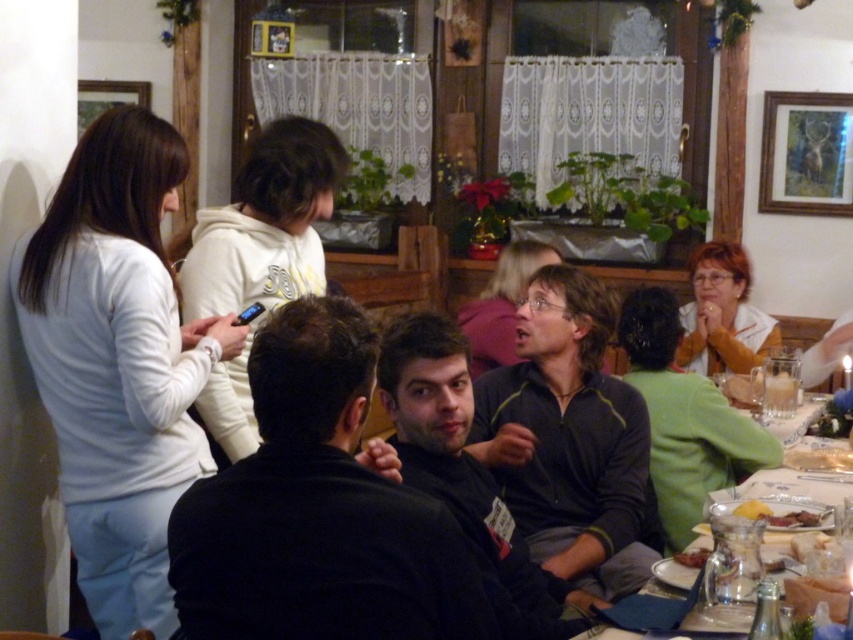
Question: Is matte black shirt at center positioned in front of shiny silver fork at lower right?

Choices:
 (A) no
 (B) yes

Answer: (A)

Question: Which point is farther to the camera?

Choices:
 (A) (289, 240)
 (B) (698, 566)
 (C) (628, 353)
 (D) (519, 380)

Answer: (C)

Question: Among these points, which one is farthest from the camera?

Choices:
 (A) (662, 486)
 (B) (474, 328)
 (C) (590, 404)
 (D) (727, 250)

Answer: (D)

Question: Which point is closer to the camera?

Choices:
 (A) (486, 333)
 (B) (109, 531)
 (C) (700, 296)
 (D) (619, 445)

Answer: (B)

Question: Can you confirm if green sweater at right is smaller than translucent glass pitcher at lower right?

Choices:
 (A) yes
 (B) no

Answer: (B)

Question: Is white matte shirt at left below matte black shirt at center?

Choices:
 (A) yes
 (B) no

Answer: (A)